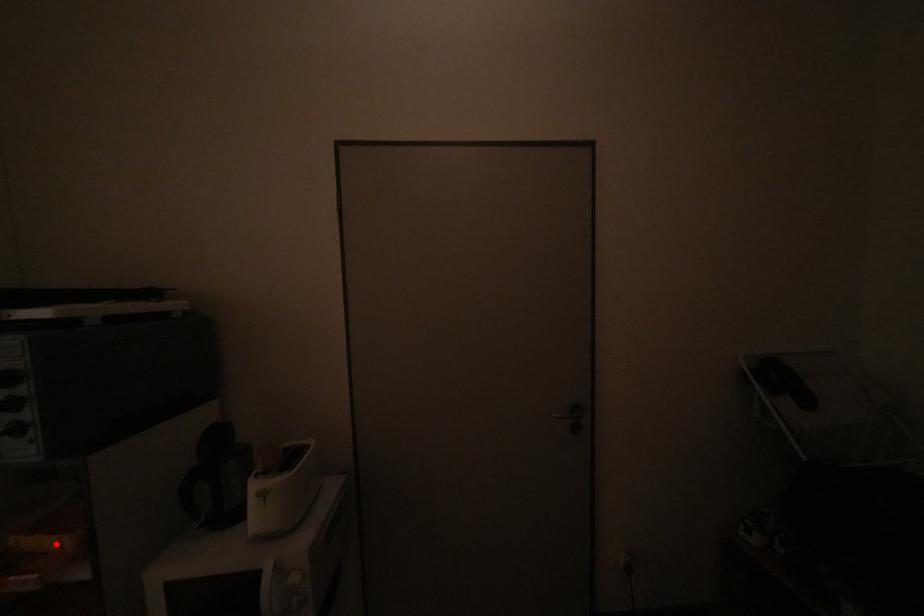
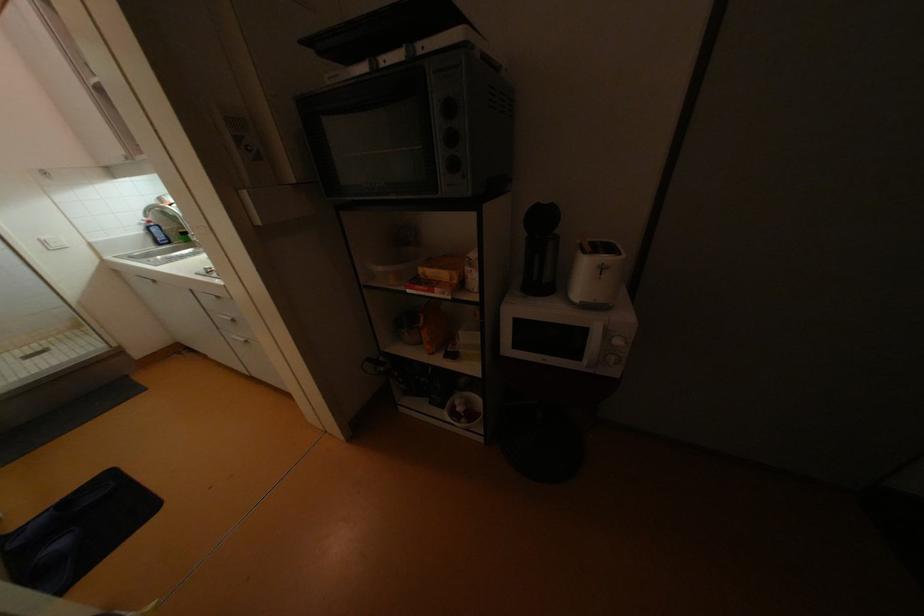
Where in the second image is the point corresponding to the highlighted location from the first image?

(450, 276)